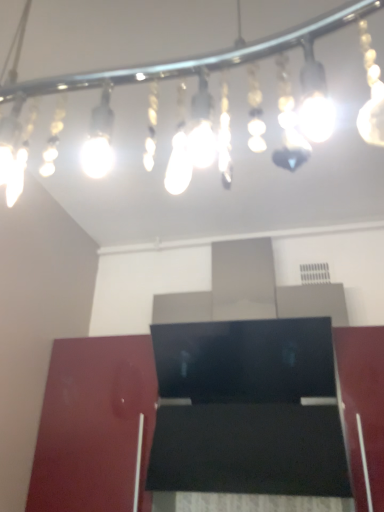
Question: Does translucent glass light fixture at upper center have a greater height compared to glossy wood cabinet at lower left?

Choices:
 (A) yes
 (B) no

Answer: (B)

Question: From the image's perspective, is translucent glass light fixture at upper center on glossy wood cabinet at lower left?

Choices:
 (A) yes
 (B) no

Answer: (A)

Question: From a real-world perspective, is translucent glass light fixture at upper center under glossy wood cabinet at lower left?

Choices:
 (A) yes
 (B) no

Answer: (B)

Question: Can you confirm if translucent glass light fixture at upper center is wider than glossy wood cabinet at lower left?

Choices:
 (A) yes
 (B) no

Answer: (A)

Question: From the image's perspective, is translucent glass light fixture at upper center located beneath glossy wood cabinet at lower left?

Choices:
 (A) yes
 (B) no

Answer: (B)

Question: Is translucent glass light fixture at upper center at the right side of glossy wood cabinet at lower left?

Choices:
 (A) yes
 (B) no

Answer: (A)

Question: Can you confirm if glossy wood cabinet at lower left is bigger than translucent glass light fixture at upper center?

Choices:
 (A) yes
 (B) no

Answer: (A)

Question: From the image's perspective, would you say glossy wood cabinet at lower left is positioned over translucent glass light fixture at upper center?

Choices:
 (A) no
 (B) yes

Answer: (A)

Question: Is glossy wood cabinet at lower left located outside translucent glass light fixture at upper center?

Choices:
 (A) yes
 (B) no

Answer: (A)

Question: Is glossy wood cabinet at lower left smaller than translucent glass light fixture at upper center?

Choices:
 (A) yes
 (B) no

Answer: (B)

Question: Is glossy wood cabinet at lower left at the left side of translucent glass light fixture at upper center?

Choices:
 (A) no
 (B) yes

Answer: (B)

Question: From a real-world perspective, is glossy wood cabinet at lower left under translucent glass light fixture at upper center?

Choices:
 (A) no
 (B) yes

Answer: (B)

Question: Considering the positions of glossy wood cabinet at lower left and translucent glass light fixture at upper center in the image, is glossy wood cabinet at lower left taller or shorter than translucent glass light fixture at upper center?

Choices:
 (A) short
 (B) tall

Answer: (B)